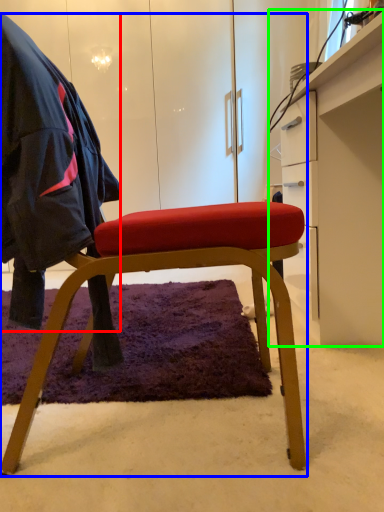
Question: Estimate the real-world distances between objects in this image. Which object is closer to cloak (highlighted by a red box), chair (highlighted by a blue box) or desk (highlighted by a green box)?

Choices:
 (A) chair
 (B) desk

Answer: (A)